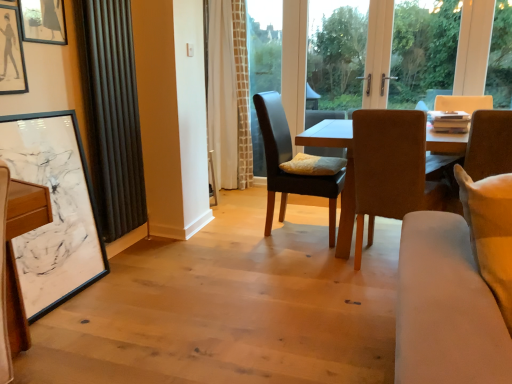
Question: From their relative heights in the image, would you say suede brown chair at center, acting as the second chair starting from the right, is taller or shorter than white textured curtain at center, which is counted as the second curtain, starting from the front?

Choices:
 (A) short
 (B) tall

Answer: (A)

Question: Considering the positions of point (387, 160) and point (216, 160), is point (387, 160) closer or farther from the camera than point (216, 160)?

Choices:
 (A) farther
 (B) closer

Answer: (B)

Question: Which object is positioned farthest from the soft yellow pillow at center?

Choices:
 (A) matte black picture frame at upper left, marked as the first picture frame in a top-to-bottom arrangement
 (B) leather cushioned chair at center, the 1th chair in the left-to-right sequence
 (C) suede brown chair at center, which is the second chair in left-to-right order
 (D) white textured curtain at center, which is counted as the first curtain, starting from the back
 (E) light beige fabric couch at lower right

Answer: (E)

Question: Which object is positioned closest to the orange textured curtain at center?

Choices:
 (A) white matte picture frame at left, placed as the third picture frame when sorted from top to bottom
 (B) soft yellow pillow at center
 (C) matte black picture frame at upper left, marked as the first picture frame in a top-to-bottom arrangement
 (D) brown leather chair at right, the third chair viewed from the left
 (E) white textured curtain at center, which is counted as the first curtain, starting from the back

Answer: (E)